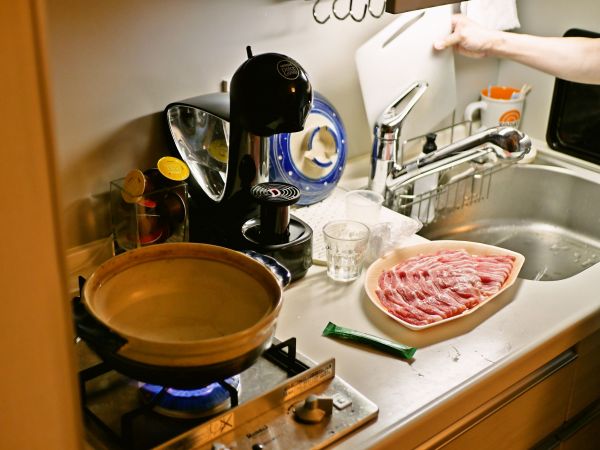
This screenshot has width=600, height=450. Identify the location of drying rack. (317, 215).